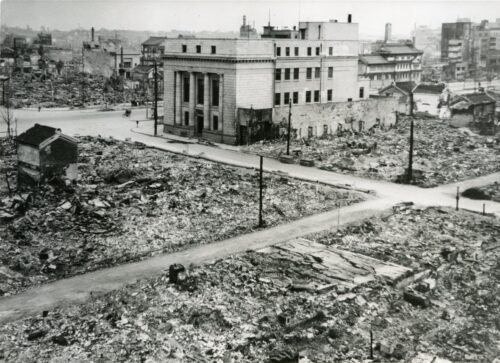
Find the location of a particular element. chimney is located at coordinates coord(386,30).